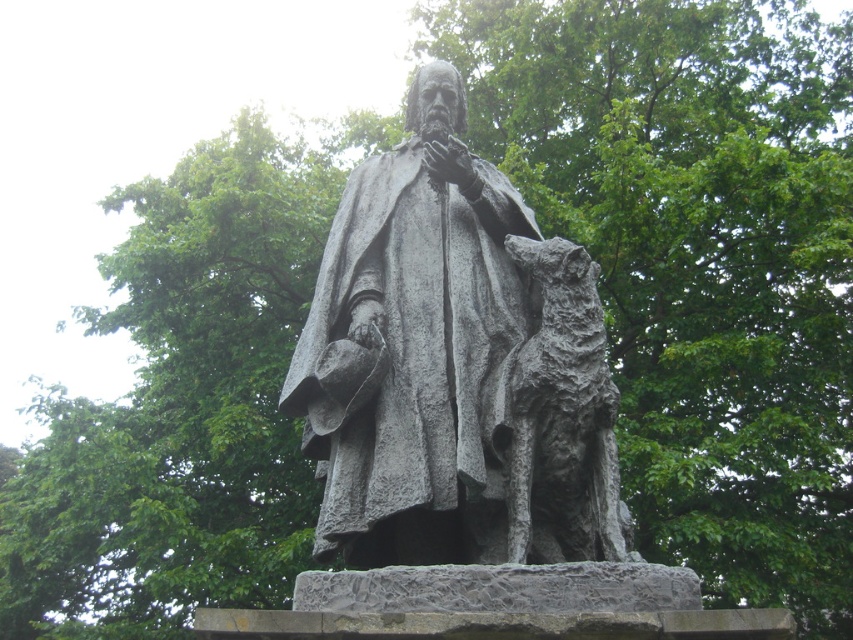
Does gray stone statue at center have a greater width compared to rough stone dog at center?

Yes, gray stone statue at center is wider than rough stone dog at center.

Between gray stone statue at center and rough stone dog at center, which one is positioned higher?

gray stone statue at center is above.

Is point (328, 372) closer to camera compared to point (529, 449)?

That is False.

This screenshot has height=640, width=853. Identify the location of gray stone statue at center. (456, 365).